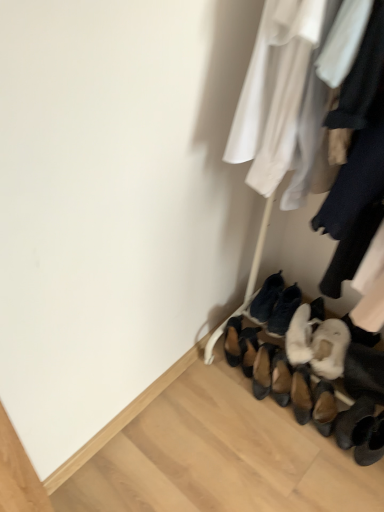
Question: Would you consider white fur boot at lower right, the fifth footwear in the left-to-right sequence, to be distant from brown suede shoes at lower center, placed as the second footwear when sorted from left to right?

Choices:
 (A) yes
 (B) no

Answer: (B)

Question: Does white fur boot at lower right, the fifth footwear in the left-to-right sequence, have a smaller size compared to brown suede shoes at lower center, placed as the second footwear when sorted from left to right?

Choices:
 (A) yes
 (B) no

Answer: (B)

Question: From the image's perspective, is white fur boot at lower right, the fifth footwear in the left-to-right sequence, below brown suede shoes at lower center, placed as the second footwear when sorted from left to right?

Choices:
 (A) yes
 (B) no

Answer: (B)

Question: Can you see white fur boot at lower right, the fifth footwear in the left-to-right sequence, touching brown suede shoes at lower center, placed as the second footwear when sorted from left to right?

Choices:
 (A) yes
 (B) no

Answer: (B)

Question: Could you tell me if white fur boot at lower right, the 2th footwear viewed from the right, is turned towards brown suede shoes at lower center, the fifth footwear in the right-to-left sequence?

Choices:
 (A) yes
 (B) no

Answer: (B)

Question: Is white fur boot at lower right, the 2th footwear viewed from the right, positioned with its back to brown suede shoes at lower center, placed as the second footwear when sorted from left to right?

Choices:
 (A) yes
 (B) no

Answer: (B)

Question: Does black suede shoes at lower center, acting as the 4th footwear starting from the right, come behind brown suede shoes at lower center, the fifth footwear in the right-to-left sequence?

Choices:
 (A) no
 (B) yes

Answer: (B)

Question: Considering the relative sizes of black suede shoes at lower center, acting as the 4th footwear starting from the right, and brown suede shoes at lower center, the fifth footwear in the right-to-left sequence, in the image provided, is black suede shoes at lower center, acting as the 4th footwear starting from the right, shorter than brown suede shoes at lower center, the fifth footwear in the right-to-left sequence,?

Choices:
 (A) yes
 (B) no

Answer: (A)

Question: From the image's perspective, is black suede shoes at lower center, marked as the 3th footwear in a left-to-right arrangement, beneath brown suede shoes at lower center, the fifth footwear in the right-to-left sequence?

Choices:
 (A) no
 (B) yes

Answer: (A)

Question: Is black suede shoes at lower center, marked as the 3th footwear in a left-to-right arrangement, aimed at brown suede shoes at lower center, placed as the second footwear when sorted from left to right?

Choices:
 (A) no
 (B) yes

Answer: (A)

Question: Is black suede shoes at lower center, acting as the 4th footwear starting from the right, positioned beyond the bounds of brown suede shoes at lower center, placed as the second footwear when sorted from left to right?

Choices:
 (A) yes
 (B) no

Answer: (A)

Question: Does black suede shoes at lower center, marked as the 3th footwear in a left-to-right arrangement, have a lesser width compared to brown suede shoes at lower center, placed as the second footwear when sorted from left to right?

Choices:
 (A) yes
 (B) no

Answer: (B)

Question: Can you confirm if brown suede shoes at lower center, placed as the second footwear when sorted from left to right, is smaller than black suede shoes at lower center, acting as the 4th footwear starting from the right?

Choices:
 (A) yes
 (B) no

Answer: (A)